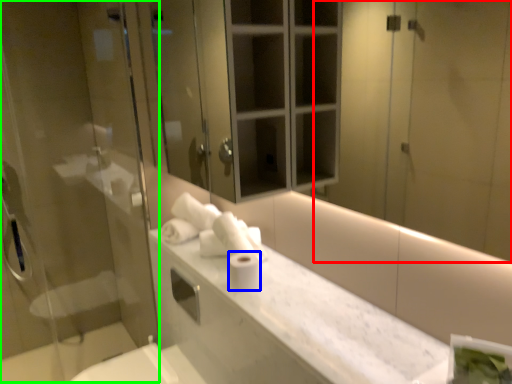
Question: Estimate the real-world distances between objects in this image. Which object is farther from mirror (highlighted by a red box), toilet paper (highlighted by a blue box) or screen door (highlighted by a green box)?

Choices:
 (A) toilet paper
 (B) screen door

Answer: (B)